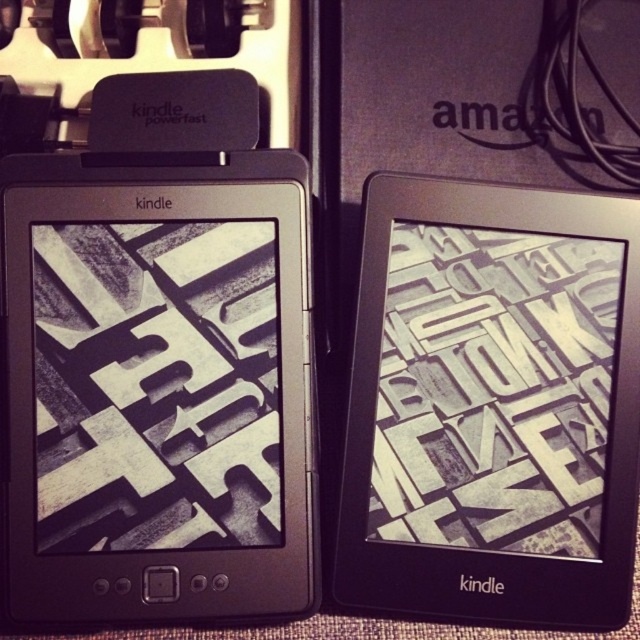
You are looking at two Amazon Kindle e readers placed side by side on a textured surface. You notice a point marked at coordinates [156,387]. Which e reader is this point indicating?

The point marked at coordinates [156,387] indicates the black matte e reader at left.